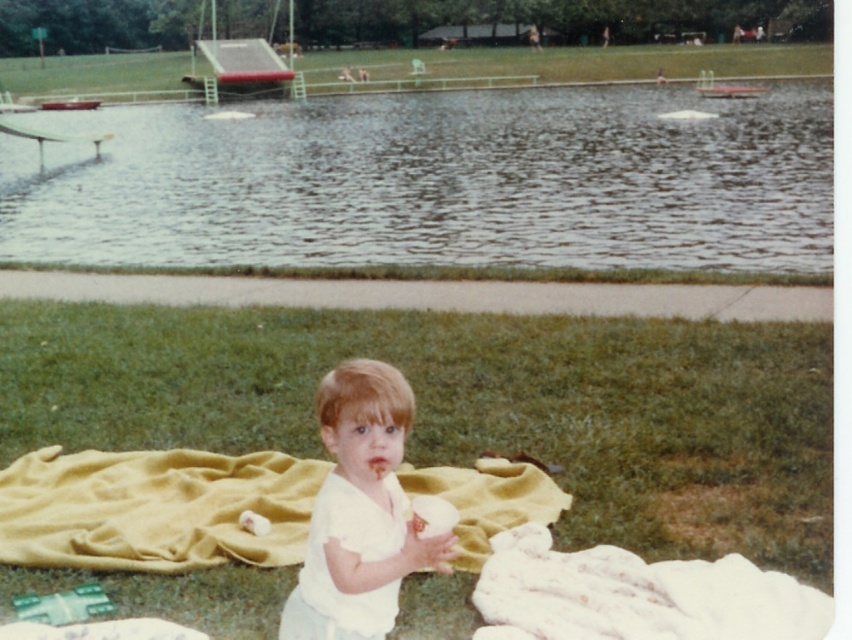
Question: Does glossy water at upper center have a lesser width compared to white matte toddler at center?

Choices:
 (A) yes
 (B) no

Answer: (B)

Question: Which object is closer to the camera taking this photo?

Choices:
 (A) green grass at center
 (B) glossy water at upper center

Answer: (A)

Question: Which object appears closest to the camera in this image?

Choices:
 (A) green grass at upper center
 (B) green grass at center
 (C) white matte toddler at center
 (D) yellow fabric blanket at center

Answer: (C)

Question: In this image, where is yellow fabric blanket at center located relative to green grass at upper center?

Choices:
 (A) below
 (B) above

Answer: (A)

Question: Can you confirm if green grass at center is positioned to the right of glossy water at upper center?

Choices:
 (A) yes
 (B) no

Answer: (A)

Question: Among these points, which one is nearest to the camera?

Choices:
 (A) (343, 554)
 (B) (122, 145)
 (C) (758, 419)

Answer: (A)